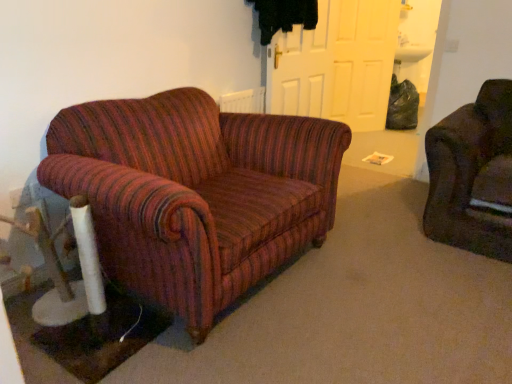
Question: Which direction should I rotate to look at white matte door at center, which is the first door from front to back, — up or down?

Choices:
 (A) down
 (B) up

Answer: (B)

Question: Does white matte door at upper center, the first door from the right, lie behind white matte door at center, which is the first door from front to back?

Choices:
 (A) yes
 (B) no

Answer: (A)

Question: Is white matte door at upper center, arranged as the 1th door when viewed from the back, positioned in front of white matte door at center, which appears as the second door when viewed from the back?

Choices:
 (A) yes
 (B) no

Answer: (B)

Question: Could you tell me if white matte door at upper center, arranged as the 1th door when viewed from the back, is facing white matte door at center, which appears as the second door when viewed from the back?

Choices:
 (A) yes
 (B) no

Answer: (B)

Question: Does white matte door at upper center, arranged as the 1th door when viewed from the back, have a lesser height compared to white matte door at center, which is the first door from front to back?

Choices:
 (A) no
 (B) yes

Answer: (A)

Question: Does white matte door at upper center, which appears as the second door when viewed from the left, appear on the right side of white matte door at center, arranged as the second door when viewed from the right?

Choices:
 (A) yes
 (B) no

Answer: (A)

Question: Can you confirm if white matte door at upper center, which appears as the second door when viewed from the left, is smaller than white matte door at center, the first door in the left-to-right sequence?

Choices:
 (A) no
 (B) yes

Answer: (A)

Question: Does white matte door at center, the first door in the left-to-right sequence, touch white matte door at upper center, the first door from the right?

Choices:
 (A) no
 (B) yes

Answer: (A)

Question: Does white matte door at center, which is the first door from front to back, have a smaller size compared to white matte door at upper center, arranged as the 1th door when viewed from the back?

Choices:
 (A) yes
 (B) no

Answer: (A)

Question: Is white matte door at center, which appears as the second door when viewed from the back, positioned behind white matte door at upper center, which appears as the second door when viewed from the left?

Choices:
 (A) yes
 (B) no

Answer: (B)

Question: Is white matte door at center, arranged as the second door when viewed from the right, facing towards white matte door at upper center, the first door from the right?

Choices:
 (A) no
 (B) yes

Answer: (A)

Question: Can you confirm if white matte door at center, arranged as the second door when viewed from the right, is positioned to the left of white matte door at upper center, which appears as the second door when viewed from the left?

Choices:
 (A) yes
 (B) no

Answer: (A)

Question: Is white matte door at center, arranged as the second door when viewed from the right, wider than white matte door at upper center, arranged as the 1th door when viewed from the back?

Choices:
 (A) yes
 (B) no

Answer: (B)

Question: Relative to white matte door at center, which appears as the second door when viewed from the back, is white matte door at upper center, the first door from the right, in front or behind?

Choices:
 (A) behind
 (B) front

Answer: (A)